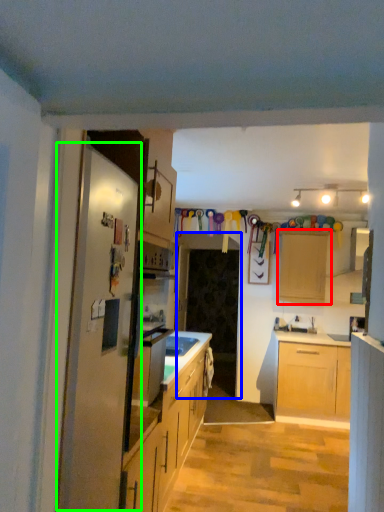
Question: Based on their relative distances, which object is farther from cabinetry (highlighted by a red box)? Choose from glass door (highlighted by a blue box) and fridge (highlighted by a green box).

Choices:
 (A) glass door
 (B) fridge

Answer: (B)